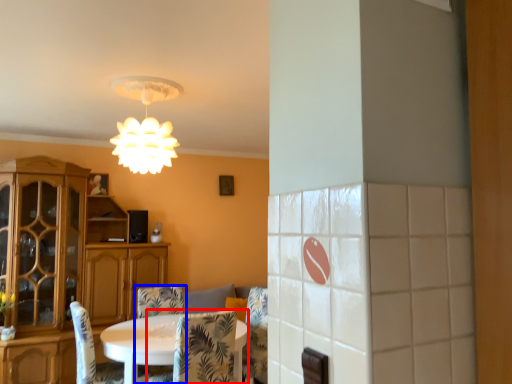
Question: Which object appears closest to the camera in this image, chair (highlighted by a red box) or chair (highlighted by a blue box)?

Choices:
 (A) chair
 (B) chair

Answer: (A)